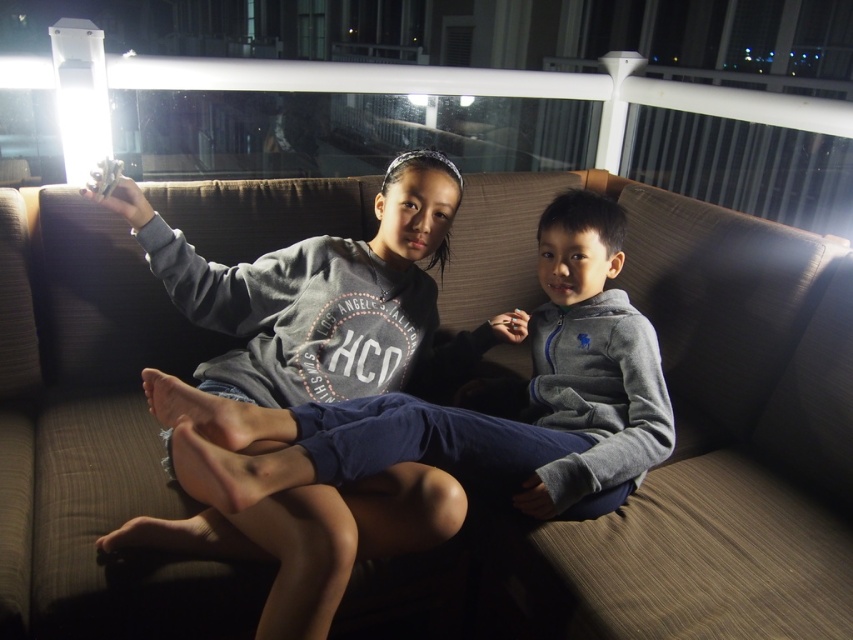
Is brown fabric couch at center shorter than gray fleece sweatshirt at center?

Incorrect, brown fabric couch at center's height does not fall short of gray fleece sweatshirt at center's.

Which is below, brown fabric couch at center or gray fleece sweatshirt at center?

gray fleece sweatshirt at center is lower down.

Measure the distance between point (1,541) and camera.

Point (1,541) and camera are 3.70 feet apart from each other.

Where is `brown fabric couch at center`? brown fabric couch at center is located at coordinates (689, 424).